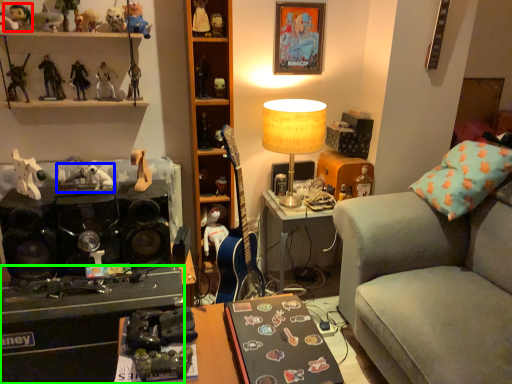
Question: Which object is the closest to the toy (highlighted by a red box)? Choose among these: toy (highlighted by a blue box) or desk (highlighted by a green box).

Choices:
 (A) toy
 (B) desk

Answer: (A)